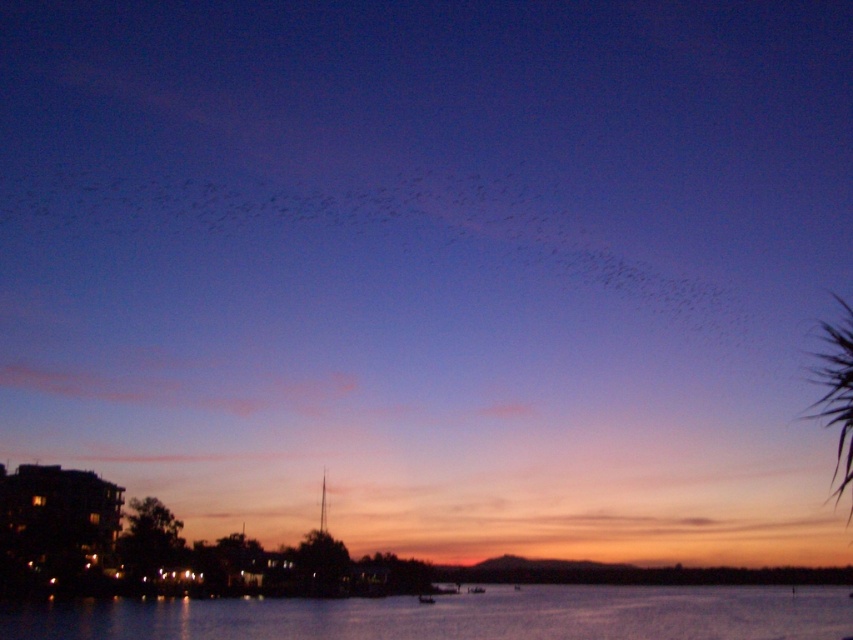
You are a photographer standing at the lakeside and want to capture a photo of the green leafy palm tree at upper right and the transparent water at lower center. Which object appears taller in the photo?

The transparent water at lower center is much taller than the green leafy palm tree at upper right in the photo.

You are an ornithologist observing the twilight scene. You notice the black matte birds at upper center and the transparent water at lower center. Which object appears smaller in the image?

The black matte birds at upper center appears smaller compared to the transparent water at lower center.

You are an ornithologist observing the twilight scene. You notice the black matte birds at upper center and the green leafy palm tree at upper right. Which object is positioned further to the east if the sun is setting in the west?

The black matte birds at upper center are to the left of the green leafy palm tree at upper right. Since the sun is setting in the west, the eastern side would be to the left. Therefore, the black matte birds at upper center are positioned further to the east.